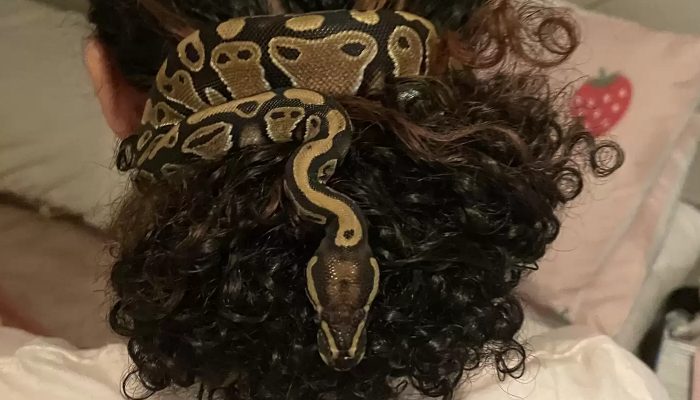
This screenshot has height=400, width=700. I want to click on mattress, so (x=678, y=259).